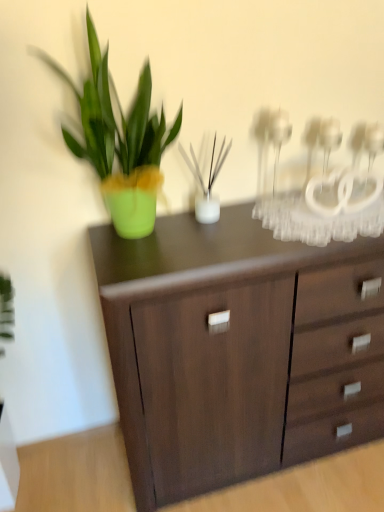
Measure the distance between green matte pot at left and camera.

The distance of green matte pot at left from camera is 3.29 feet.

The image size is (384, 512). What do you see at coordinates (120, 142) in the screenshot? I see `green matte pot at left` at bounding box center [120, 142].

Locate an element on the screen. The image size is (384, 512). green matte pot at left is located at coordinates (120, 142).

This screenshot has height=512, width=384. Identify the location of green matte pot at left. (120, 142).